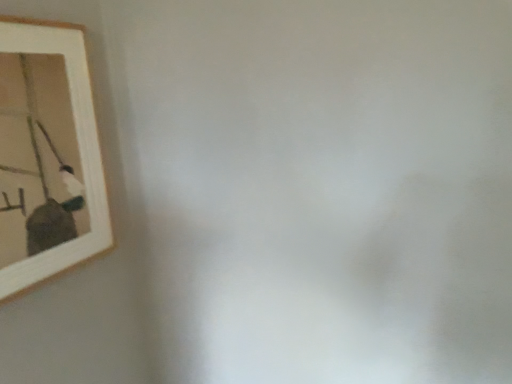
What do you see at coordinates (47, 155) in the screenshot?
I see `wooden picture frame at upper left` at bounding box center [47, 155].

This screenshot has width=512, height=384. I want to click on wooden picture frame at upper left, so click(x=47, y=155).

This screenshot has height=384, width=512. Identify the location of wooden picture frame at upper left. (47, 155).